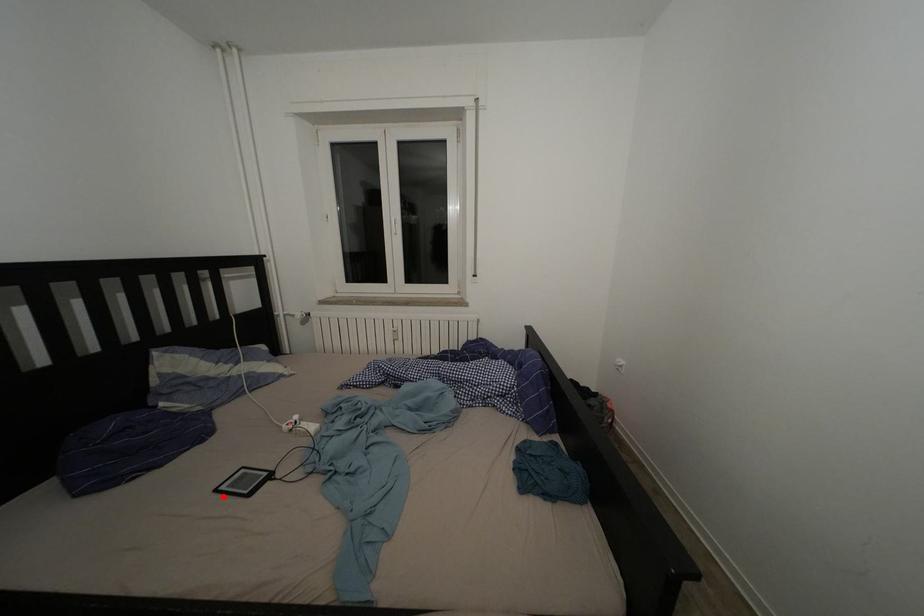
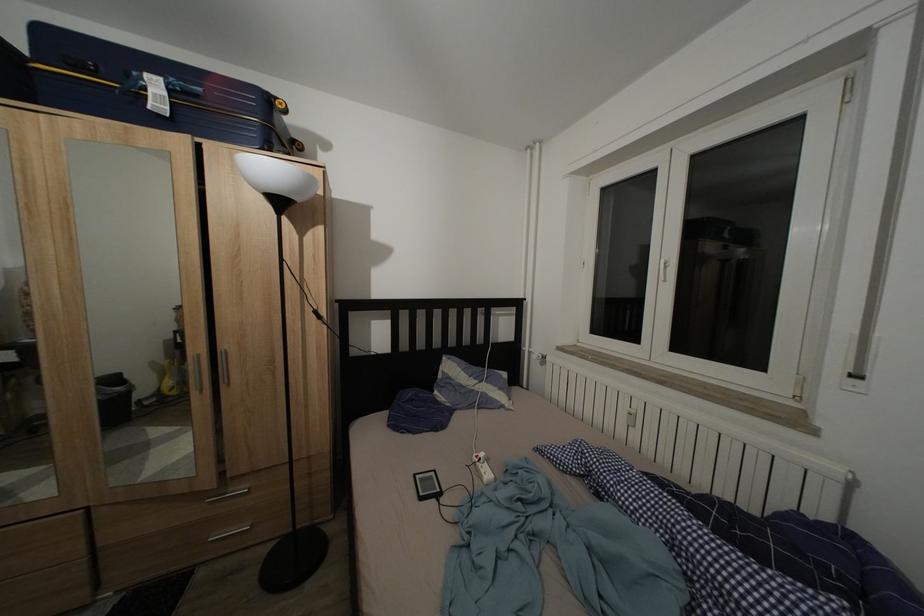
In the second image, find the point that corresponds to the highlighted location in the first image.

(422, 482)